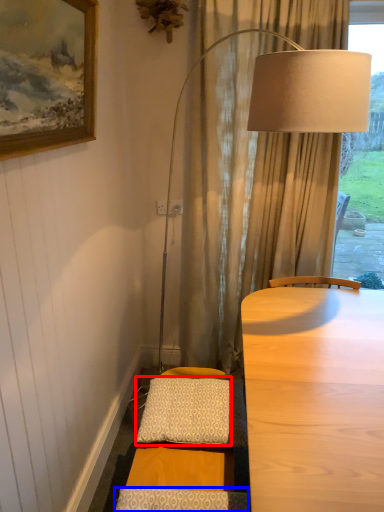
Question: Which point is further to the camera, pillow (highlighted by a red box) or pillow (highlighted by a blue box)?

Choices:
 (A) pillow
 (B) pillow

Answer: (A)